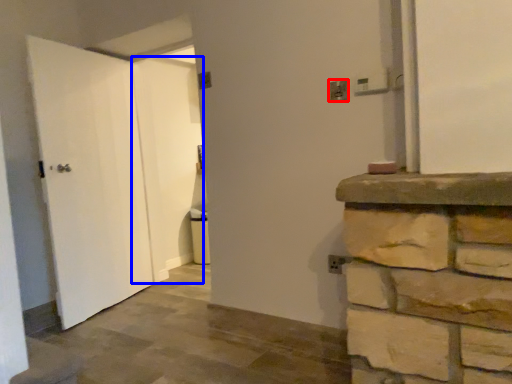
Question: Which of the following is the closest to the observer, electric outlet (highlighted by a red box) or door (highlighted by a blue box)?

Choices:
 (A) electric outlet
 (B) door

Answer: (A)